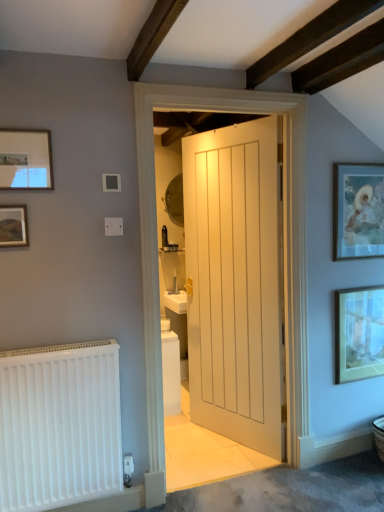
Question: From a real-world perspective, is matte black picture frame at upper left, the 3th picture frame from the right, above or below matte white picture frame at upper left, which is the first picture frame from front to back?

Choices:
 (A) below
 (B) above

Answer: (A)

Question: Does point (14, 234) appear closer or farther from the camera than point (44, 156)?

Choices:
 (A) closer
 (B) farther

Answer: (A)

Question: Which is nearer to the matte gold picture frame at upper right, which is the second picture frame in right-to-left order?

Choices:
 (A) matte gold picture frame at right, the fourth picture frame positioned from the front
 (B) matte black picture frame at upper left, the 3th picture frame from the right
 (C) white painted wood door at center
 (D) matte white picture frame at upper left, the fourth picture frame from the right
 (E) white matte radiator at lower left

Answer: (A)

Question: Which object is the farthest from the matte black picture frame at upper left, the 3th picture frame from the right?

Choices:
 (A) matte gold picture frame at right, arranged as the 1th picture frame when viewed from the back
 (B) white painted wood door at center
 (C) matte gold picture frame at upper right, the third picture frame in the left-to-right sequence
 (D) matte white picture frame at upper left, the fourth picture frame from the right
 (E) white matte radiator at lower left

Answer: (A)